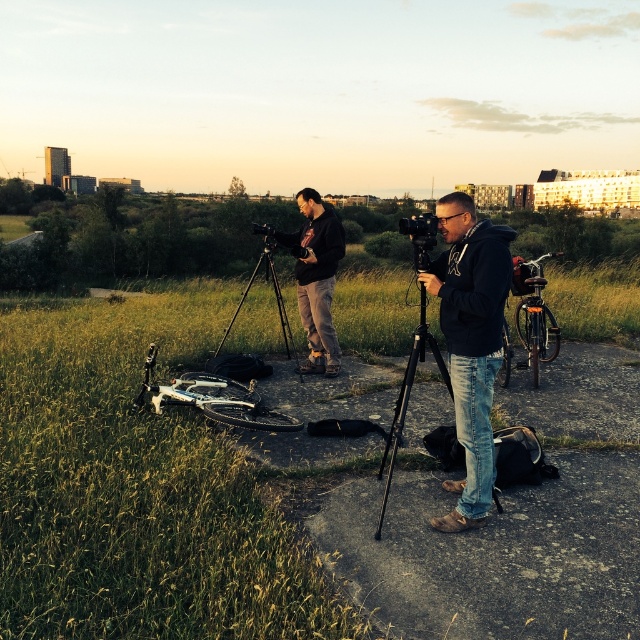
You are a photographer trying to set up your equipment. You have a black matte jacket at center and a matte black tripod at center. Which item is closer to the ground?

The black matte jacket at center is below the matte black tripod at center, so it is closer to the ground.

You are a photographer who needs to move your equipment from the black matte tripod at center to the black plastic camera at center. Given that your backpack can only carry items within a 10 meter reach, will you be able to carry both items without exceeding the distance limit?

The black matte tripod at center and black plastic camera at center are 9.58 meters apart, which is within the 10 meter reach limit. Therefore, you can carry both items without exceeding the distance limit.

You are a photographer trying to set up your equipment. You have a black matte tripod at center and a black plastic camera at center. Based on their positions, which object is closer to the ground?

The black matte tripod at center is below the black plastic camera at center, so the tripod is closer to the ground.